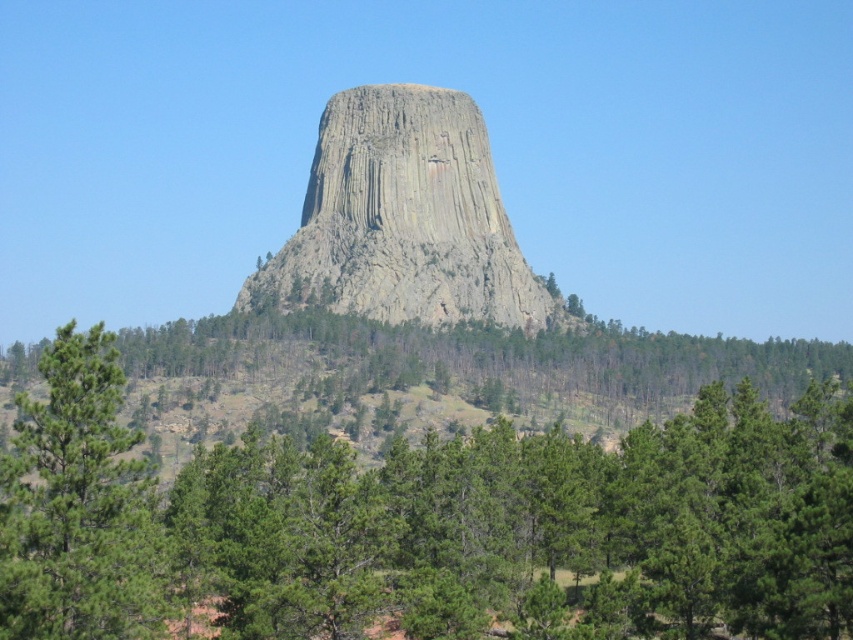
Question: Which object is the closest to the green matte tree at lower left?

Choices:
 (A) gray rock formation at center
 (B) green leafy tree at center

Answer: (B)

Question: Is green leafy tree at center below green matte tree at lower left?

Choices:
 (A) yes
 (B) no

Answer: (B)

Question: Which point is farther from the camera taking this photo?

Choices:
 (A) (78, 438)
 (B) (97, 552)

Answer: (A)

Question: Does gray rock formation at center have a lesser width compared to green matte tree at lower left?

Choices:
 (A) no
 (B) yes

Answer: (A)

Question: Which point appears closest to the camera in this image?

Choices:
 (A) (335, 172)
 (B) (35, 442)

Answer: (B)

Question: Does gray rock formation at center have a greater width compared to green matte tree at lower left?

Choices:
 (A) no
 (B) yes

Answer: (B)